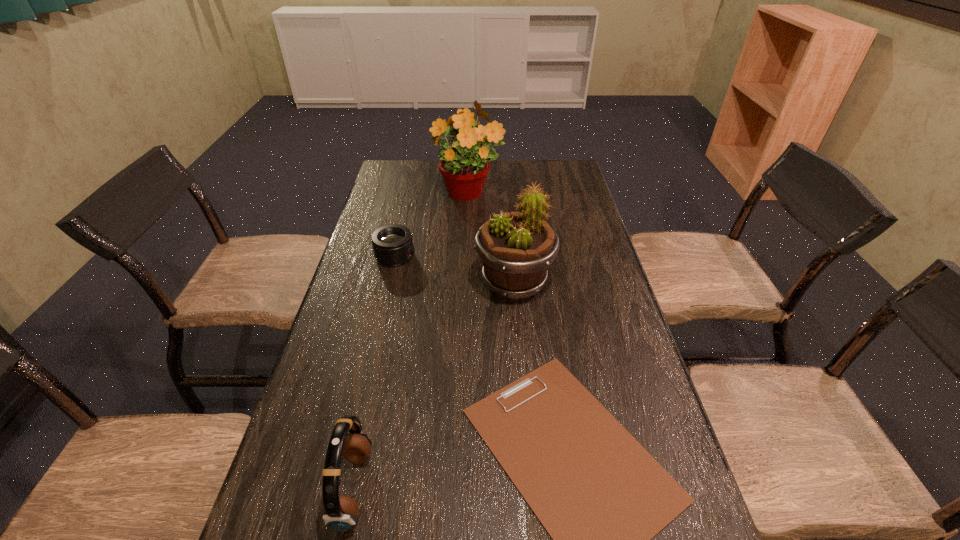
Find the location of a particular element. telephoto lens present at the left edge is located at coordinates (392, 244).

Identify the location of free space at the far edge of the desktop. (524, 179).

You are a GUI agent. You are given a task and a screenshot of the screen. Output one action in this format:
    pyautogui.click(x=<x>, y=<y>)
    Task: Click on the free space at the left edge
    
    Given the screenshot: What is the action you would take?
    pyautogui.click(x=355, y=333)

Where is `vacant region at the right edge`? This screenshot has height=540, width=960. vacant region at the right edge is located at coordinates (559, 209).

The image size is (960, 540). What are the coordinates of `vacant area at the far left corner of the desktop` in the screenshot? It's located at (408, 187).

This screenshot has height=540, width=960. In order to click on free spot between the nearer flowerpot and the third shortest object in this screenshot , I will do `click(434, 386)`.

This screenshot has height=540, width=960. Find the location of `empty space between the second shortest object and the farther flowerpot`. empty space between the second shortest object and the farther flowerpot is located at coordinates (432, 226).

Where is `free spot between the headset and the farthest object`? The image size is (960, 540). free spot between the headset and the farthest object is located at coordinates (411, 341).

You are a GUI agent. You are given a task and a screenshot of the screen. Output one action in this format:
    pyautogui.click(x=<x>, y=<y>)
    Task: Click on the empty space that is in between the third tallest object and the telephoto lens
    
    Given the screenshot: What is the action you would take?
    click(x=374, y=372)

Locate an element on the screen. This screenshot has height=540, width=960. vacant space that is in between the nearer flowerpot and the third shortest object is located at coordinates (434, 386).